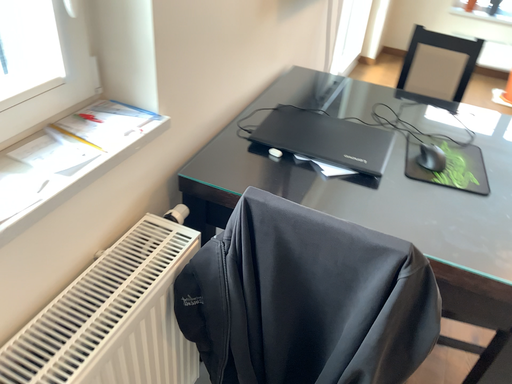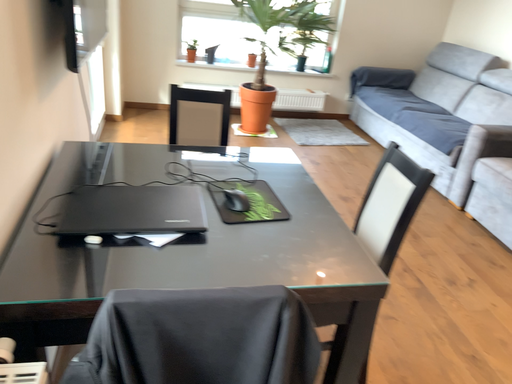
Question: How did the camera likely rotate when shooting the video?

Choices:
 (A) rotated downward
 (B) rotated upward

Answer: (B)